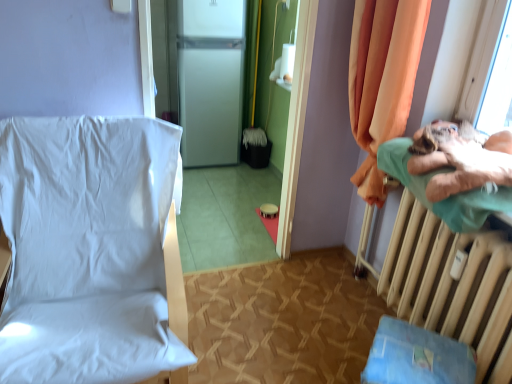
Where is `green fabric pillow at right`? The width and height of the screenshot is (512, 384). green fabric pillow at right is located at coordinates (446, 198).

Measure the distance between beige metallic radiator at right and camera.

A distance of 1.34 meters exists between beige metallic radiator at right and camera.

What are the coordinates of `white fabric chair at left` in the screenshot? It's located at (91, 251).

What do you see at coordinates (382, 79) in the screenshot? This screenshot has width=512, height=384. I see `orange fabric curtain at right` at bounding box center [382, 79].

What is the approximate width of white matte refrigerator at center?

white matte refrigerator at center is 16.80 inches in width.

At what (x,y) coordinates should I click in order to perform the action: click on green fabric pillow at right. Please return your answer as a coordinate pair (x, y). The image size is (512, 384). Looking at the image, I should click on (446, 198).

Between green fabric pillow at right and beige metallic radiator at right, which one appears on the left side from the viewer's perspective?

beige metallic radiator at right.

Who is smaller, green fabric pillow at right or beige metallic radiator at right?

green fabric pillow at right is smaller.

Is point (394, 173) in front of point (405, 298)?

Yes, point (394, 173) is closer to viewer.

Identify the location of screen door positioned vertically above the blue fabric changing table at lower right (from a real-world perspective). (210, 80).

Is blue fabric changing table at lower right at the left side of white matte refrigerator at center?

Incorrect, blue fabric changing table at lower right is not on the left side of white matte refrigerator at center.

In the scene shown: Is blue fabric changing table at lower right bigger or smaller than white matte refrigerator at center?

Clearly, blue fabric changing table at lower right is smaller in size than white matte refrigerator at center.

Considering the relative sizes of green fabric pillow at right and orange fabric curtain at right in the image provided, is green fabric pillow at right smaller than orange fabric curtain at right?

Yes.

Is green fabric pillow at right at the right side of orange fabric curtain at right?

Yes, green fabric pillow at right is to the right of orange fabric curtain at right.

From the image's perspective, is green fabric pillow at right positioned above or below orange fabric curtain at right?

green fabric pillow at right is below orange fabric curtain at right.

Which is closer to the camera, [481,210] or [400,88]?

The point [481,210] is more forward.

Looking at this image, between orange fabric curtain at right and blue fabric changing table at lower right, which one appears on the left side from the viewer's perspective?

blue fabric changing table at lower right.

Is orange fabric curtain at right oriented away from blue fabric changing table at lower right?

No, blue fabric changing table at lower right is not at the back of orange fabric curtain at right.

From a real-world perspective, is orange fabric curtain at right under blue fabric changing table at lower right?

No, from a real-world perspective, orange fabric curtain at right is not beneath blue fabric changing table at lower right.

How distant is orange fabric curtain at right from blue fabric changing table at lower right?

A distance of 88.89 centimeters exists between orange fabric curtain at right and blue fabric changing table at lower right.

Is point (447, 213) less distant than point (374, 378)?

No, it is behind (374, 378).

Is green fabric pillow at right wider or thinner than blue fabric changing table at lower right?

In the image, green fabric pillow at right appears to be wider than blue fabric changing table at lower right.

Does green fabric pillow at right have a larger size compared to blue fabric changing table at lower right?

Correct, green fabric pillow at right is larger in size than blue fabric changing table at lower right.

Does white fabric chair at left have a lesser height compared to white matte refrigerator at center?

Correct, white fabric chair at left is not as tall as white matte refrigerator at center.

From a real-world perspective, is white fabric chair at left above or below white matte refrigerator at center?

In terms of real-world spatial position, white fabric chair at left is below white matte refrigerator at center.

Considering the positions of points (101, 136) and (228, 95), is point (101, 136) farther from camera compared to point (228, 95)?

No, (101, 136) is closer to viewer.

Is blue fabric changing table at lower right completely or partially outside of beige metallic radiator at right?

That's correct, blue fabric changing table at lower right is outside of beige metallic radiator at right.

Looking at their sizes, would you say blue fabric changing table at lower right is wider or thinner than beige metallic radiator at right?

Clearly, blue fabric changing table at lower right has more width compared to beige metallic radiator at right.

You are a GUI agent. You are given a task and a screenshot of the screen. Output one action in this format:
    pyautogui.click(x=<x>, y=<y>)
    Task: Click on the changing table on the left of beige metallic radiator at right
    
    Given the screenshot: What is the action you would take?
    pyautogui.click(x=416, y=357)

In the image, is blue fabric changing table at lower right on the left side or the right side of beige metallic radiator at right?

Based on their positions, blue fabric changing table at lower right is located to the left of beige metallic radiator at right.

Identify the location of radiator located below the green fabric pillow at right (from the image's perspective). point(452,285).

Find the location of a particular element. The image size is (512, 384). changing table located underneath the white matte refrigerator at center (from a real-world perspective) is located at coordinates [x=416, y=357].

Based on their spatial positions, is blue fabric changing table at lower right or white matte refrigerator at center further from green fabric pillow at right?

white matte refrigerator at center is positioned further to the anchor green fabric pillow at right.

Based on the photo, from the image, which object appears to be farther from white matte refrigerator at center, white fabric chair at left or beige metallic radiator at right?

beige metallic radiator at right lies further to white matte refrigerator at center than the other object.

Considering their positions, is green fabric pillow at right positioned further to beige metallic radiator at right than orange fabric curtain at right?

Based on the image, orange fabric curtain at right appears to be further to beige metallic radiator at right.

Considering their positions, is green fabric pillow at right positioned further to orange fabric curtain at right than blue fabric changing table at lower right?

blue fabric changing table at lower right lies further to orange fabric curtain at right than the other object.

Based on the photo, when comparing their distances from blue fabric changing table at lower right, does white fabric chair at left or white matte refrigerator at center seem further?

Among the two, white matte refrigerator at center is located further to blue fabric changing table at lower right.

When comparing their distances from beige metallic radiator at right, does orange fabric curtain at right or white fabric chair at left seem further?

Based on the image, white fabric chair at left appears to be further to beige metallic radiator at right.

Looking at the image, which one is located closer to blue fabric changing table at lower right, white fabric chair at left or beige metallic radiator at right?

The object closer to blue fabric changing table at lower right is beige metallic radiator at right.

Which object lies nearer to the anchor point blue fabric changing table at lower right, white fabric chair at left or green fabric pillow at right?

The object closer to blue fabric changing table at lower right is green fabric pillow at right.

Locate an element on the screen. curtain positioned between beige metallic radiator at right and white matte refrigerator at center from near to far is located at coordinates (382, 79).

Identify the location of curtain between white fabric chair at left and green fabric pillow at right in the horizontal direction. Image resolution: width=512 pixels, height=384 pixels. (382, 79).

Image resolution: width=512 pixels, height=384 pixels. Find the location of `curtain between green fabric pillow at right and white matte refrigerator at center in the front-back direction`. curtain between green fabric pillow at right and white matte refrigerator at center in the front-back direction is located at coordinates (382, 79).

This screenshot has width=512, height=384. I want to click on curtain between white fabric chair at left and white matte refrigerator at center along the z-axis, so click(382, 79).